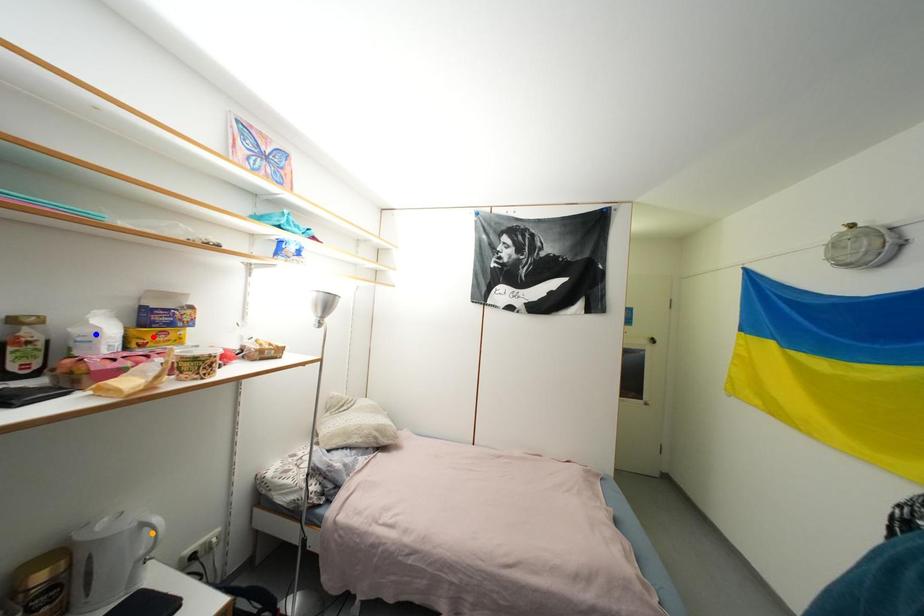
Order these from nearest to farthest:
red point | blue point | orange point

red point
orange point
blue point